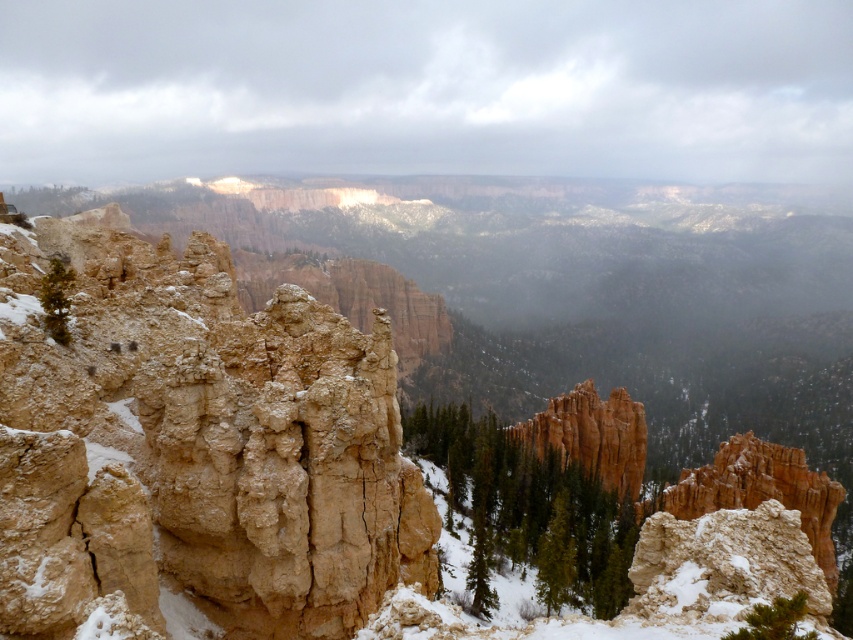
Image resolution: width=853 pixels, height=640 pixels. What do you see at coordinates (206, 432) in the screenshot?
I see `rugged sandstone canyon at center` at bounding box center [206, 432].

This screenshot has height=640, width=853. I want to click on rugged sandstone canyon at center, so click(x=206, y=432).